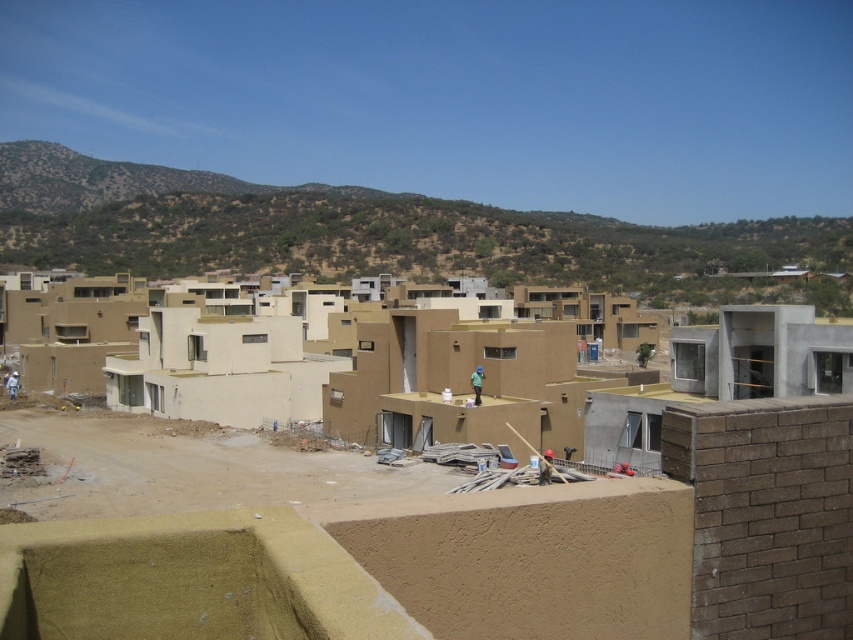
You are a drone operator tasked with capturing aerial footage of the construction site. You need to ensure that both the brown textured hillside at upper center and the green matte construction worker at center are visible in the frame. Which object should you focus on to ensure the other remains in the background without being too small?

The brown textured hillside at upper center is larger in size than the green matte construction worker at center, so focusing on the brown textured hillside at upper center would allow the green matte construction worker at center to remain visible in the background without appearing too small.

Looking at this image, you are a drone operator tasked with capturing aerial footage of the construction site. You need to fly your drone from point A to point B. Given that point A is at point (486, 221) and point B is at point (474, 401), which point is closer to the camera so that you can adjust your flight path accordingly?

Point (486, 221) is closer to the camera than point (474, 401) because it is further to the camera than the other point.

You are a construction supervisor who needs to ensure safety on the site. The matte beige building at center and the green matte construction worker at center are both in your line of sight. Which object is taller and requires closer monitoring for potential hazards?

The matte beige building at center is much taller than the green matte construction worker at center, so it requires closer monitoring for potential hazards due to its height.